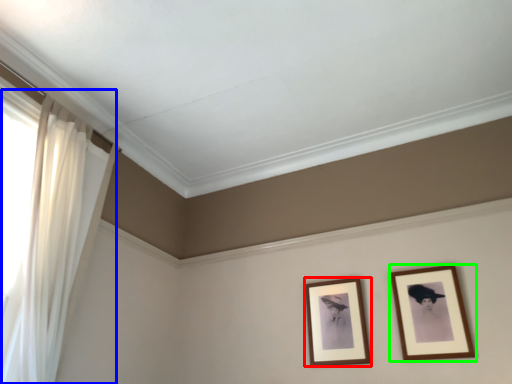
Question: Which is nearer to the picture frame (highlighted by a red box)? curtain (highlighted by a blue box) or picture frame (highlighted by a green box).

Choices:
 (A) curtain
 (B) picture frame

Answer: (B)